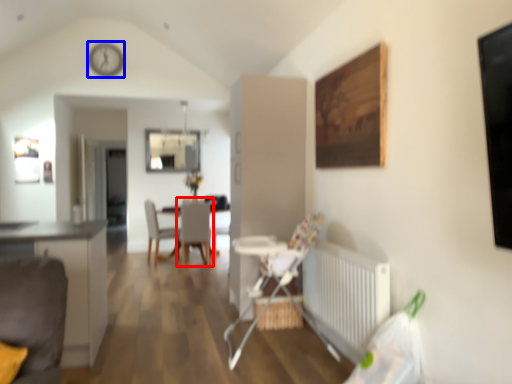
Question: Which point is further to the camera, chair (highlighted by a red box) or clock (highlighted by a blue box)?

Choices:
 (A) chair
 (B) clock

Answer: (B)